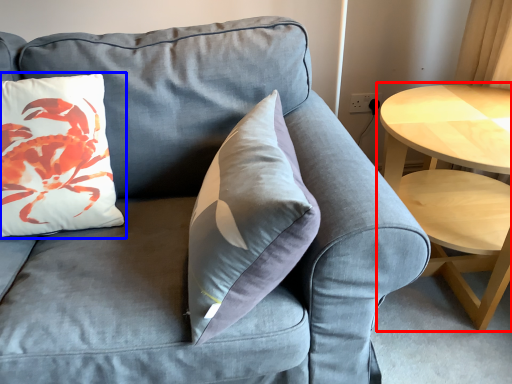
Question: Which object is closer to the camera taking this photo, coffee table (highlighted by a red box) or pillow (highlighted by a blue box)?

Choices:
 (A) coffee table
 (B) pillow

Answer: (B)